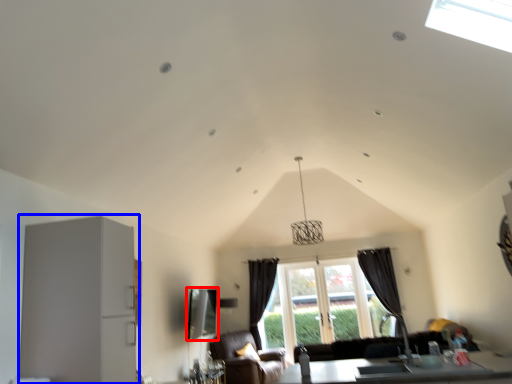
Question: Which of the following is the farthest to the observer, window screen (highlighted by a red box) or appliance (highlighted by a blue box)?

Choices:
 (A) window screen
 (B) appliance

Answer: (A)